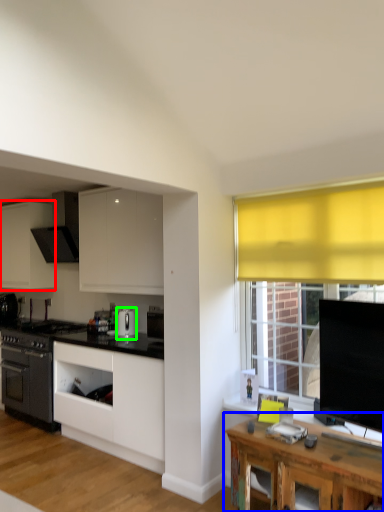
Question: Which object is positioned closest to cabinetry (highlighted by a red box)? Select from table (highlighted by a blue box) and kitchen appliance (highlighted by a green box).

Choices:
 (A) table
 (B) kitchen appliance

Answer: (B)